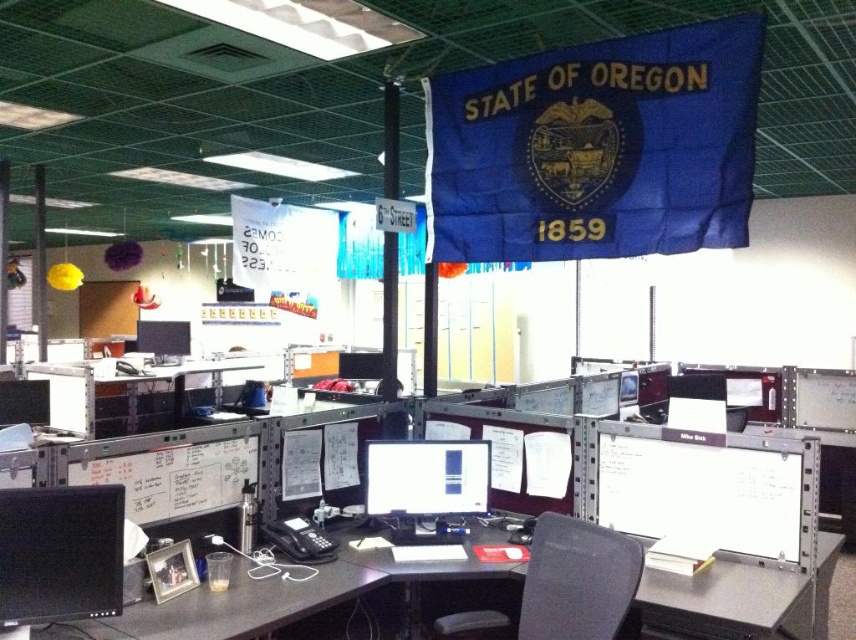
Question: Which point is farther to the camera?

Choices:
 (A) (46, 497)
 (B) (749, 524)
 (C) (129, 636)
 (D) (147, 323)

Answer: (D)

Question: Which object is closer to the camera taking this photo?

Choices:
 (A) matte black monitor at left
 (B) blue fabric flag at upper center
 (C) black plastic table at lower left

Answer: (C)

Question: Where is blue fabric flag at upper center located in relation to white paperboard at right in the image?

Choices:
 (A) above
 (B) below

Answer: (A)

Question: Does white paperboard at right come behind black fabric swivel chair at center?

Choices:
 (A) yes
 (B) no

Answer: (A)

Question: Observing the image, what is the correct spatial positioning of blue fabric flag at upper center in reference to matte black monitor at upper left?

Choices:
 (A) left
 (B) right

Answer: (B)

Question: Which of the following is the farthest from the observer?

Choices:
 (A) matte black monitor at upper left
 (B) matte black monitor at left

Answer: (A)